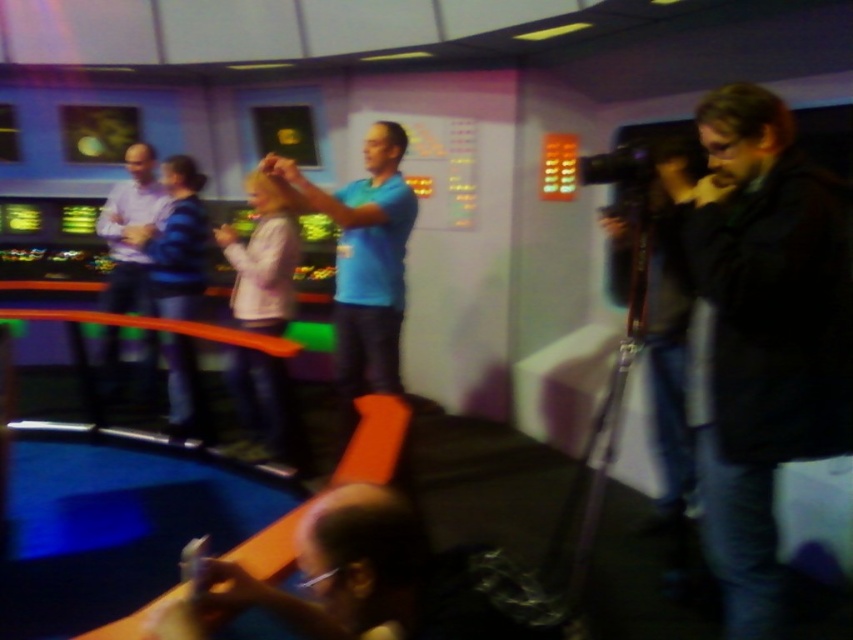
Who is more distant from viewer, (x=741, y=109) or (x=119, y=198)?

The point (x=119, y=198) is behind.

Does dark brown leather jacket at right have a smaller size compared to light purple shirt at left?

Actually, dark brown leather jacket at right might be larger than light purple shirt at left.

The height and width of the screenshot is (640, 853). What are the coordinates of `dark brown leather jacket at right` in the screenshot? It's located at (759, 332).

Locate an element on the screen. The width and height of the screenshot is (853, 640). dark brown leather jacket at right is located at coordinates (759, 332).

Is point (726, 193) closer to viewer compared to point (183, 186)?

Yes.

Between point (752, 557) and point (180, 371), which one is positioned behind?

The point (180, 371) is behind.

What do you see at coordinates (759, 332) in the screenshot? This screenshot has height=640, width=853. I see `dark brown leather jacket at right` at bounding box center [759, 332].

Where is `dark brown leather jacket at right`? The width and height of the screenshot is (853, 640). dark brown leather jacket at right is located at coordinates (759, 332).

Does dark brown leather jacket at right have a lesser width compared to blue matte shirt at center?

Yes, dark brown leather jacket at right is thinner than blue matte shirt at center.

Does point (704, 308) come in front of point (390, 209)?

Yes, it is in front of point (390, 209).

The height and width of the screenshot is (640, 853). I want to click on dark brown leather jacket at right, so click(x=759, y=332).

At what (x,y) coordinates should I click in order to perform the action: click on dark brown leather jacket at right. Please return your answer as a coordinate pair (x, y). The height and width of the screenshot is (640, 853). Looking at the image, I should click on (759, 332).